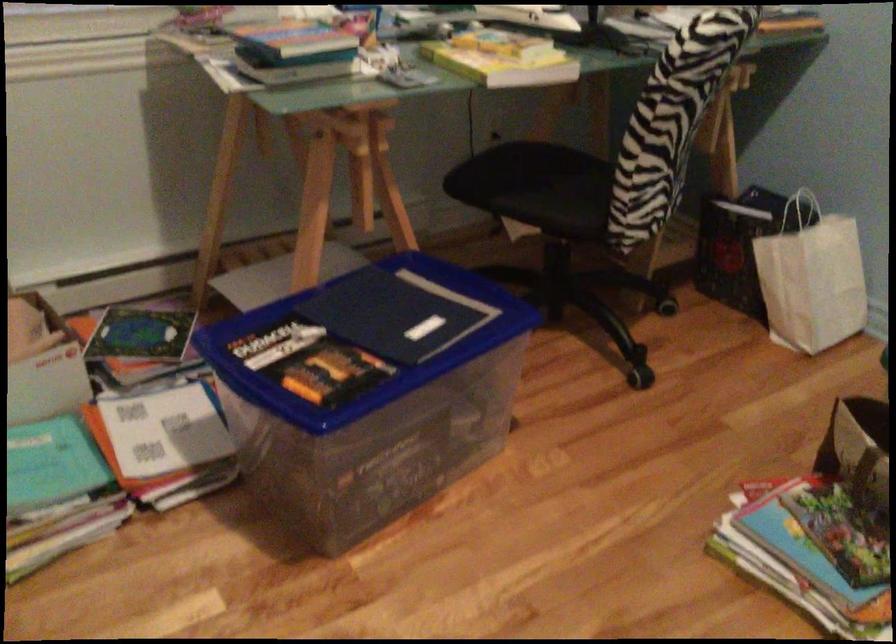
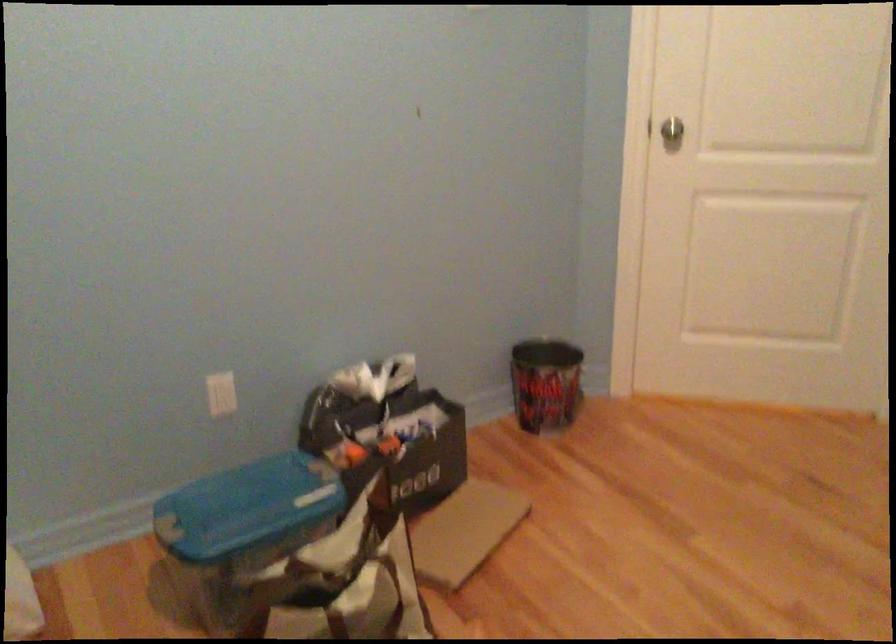
The images are taken continuously from a first-person perspective. In which direction is your viewpoint rotating?

The rotation direction of the camera is right-down.